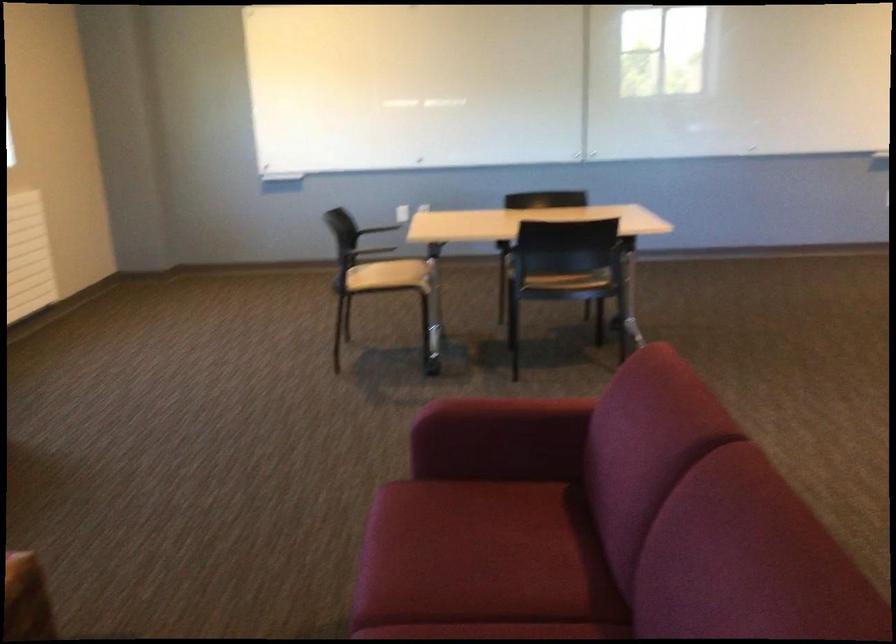
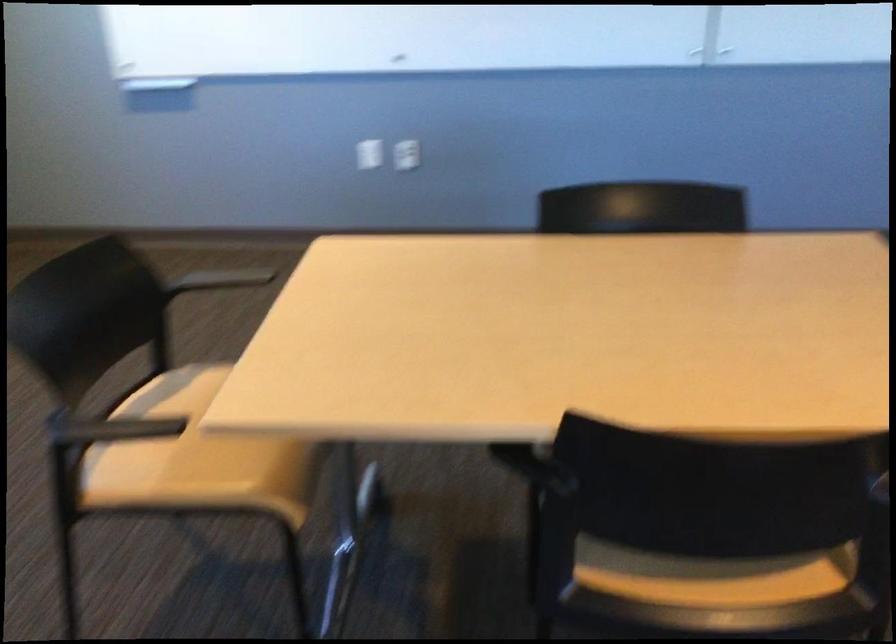
The point at (x=392, y=275) is marked in the first image. Where is the corresponding point in the second image?

(194, 458)